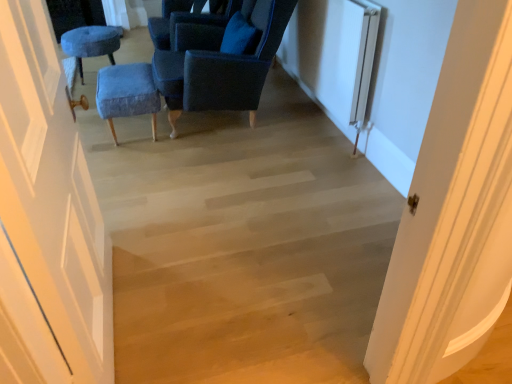
This screenshot has height=384, width=512. I want to click on empty space that is to the right of white matte door at left, so click(216, 314).